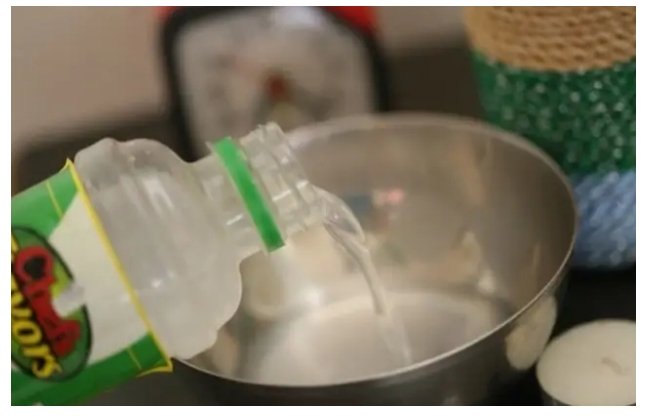
This screenshot has width=650, height=420. What are the coordinates of `metal silver bowl` in the screenshot? It's located at (439, 173).